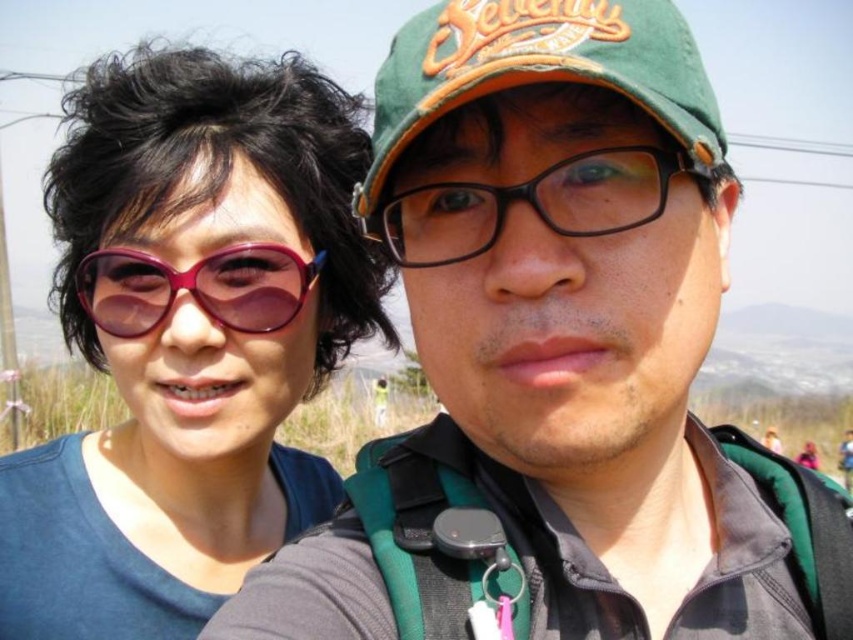
Question: Can you confirm if black plastic glasses at center is wider than pink glossy sunglasses at left?

Choices:
 (A) yes
 (B) no

Answer: (B)

Question: Which object is the closest to the pink glossy sunglasses at left?

Choices:
 (A) green fabric baseball cap at upper center
 (B) matte purple sunglasses at upper left
 (C) black plastic glasses at center

Answer: (B)

Question: Estimate the real-world distances between objects in this image. Which object is farther from the black plastic glasses at center?

Choices:
 (A) green fabric baseball cap at upper center
 (B) pink glossy sunglasses at left
 (C) matte purple sunglasses at upper left

Answer: (C)

Question: Is the position of matte purple sunglasses at upper left more distant than that of green fabric baseball cap at upper center?

Choices:
 (A) yes
 (B) no

Answer: (A)

Question: Which point appears closest to the camera in this image?

Choices:
 (A) (335, 188)
 (B) (432, 45)
 (C) (254, 253)
 (D) (408, 230)

Answer: (B)

Question: Can you confirm if green fabric baseball cap at upper center is positioned to the left of pink glossy sunglasses at left?

Choices:
 (A) no
 (B) yes

Answer: (A)